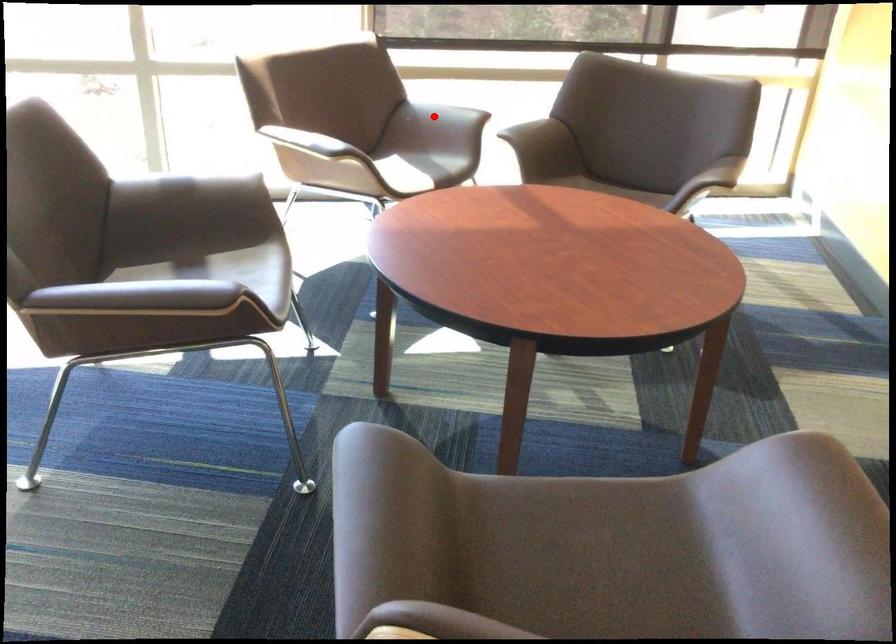
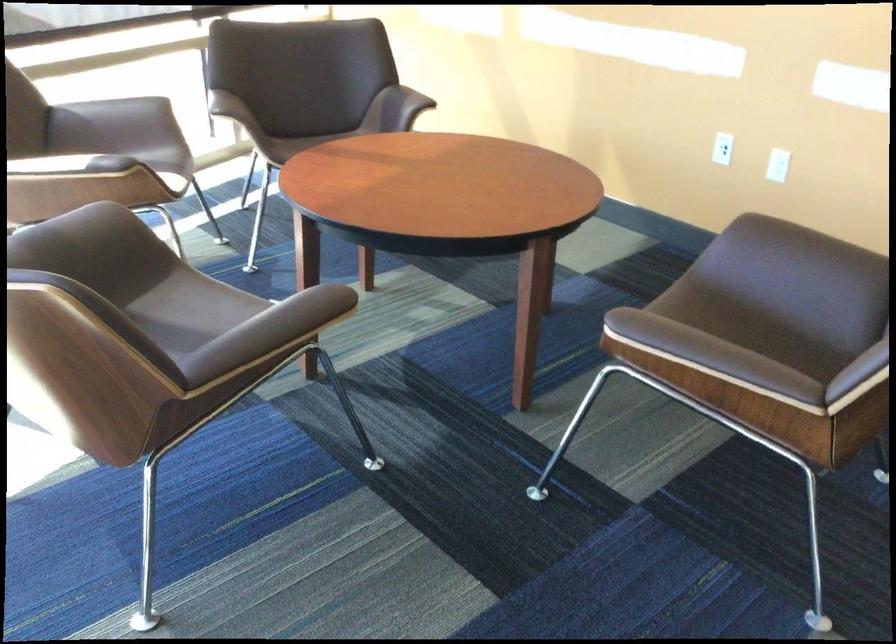
Question: I am providing you with two images of the same scene from different viewpoints. Image1 has a red point marked. In image2, the corresponding 3D location appears at what relative position? Reply with the corresponding letter.

Choices:
 (A) Closer
 (B) Farther

Answer: (A)